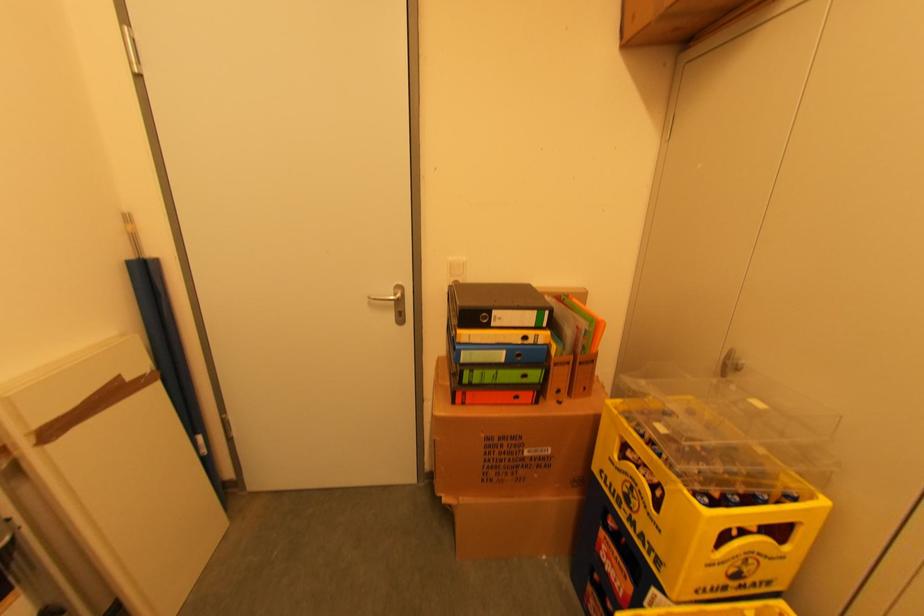
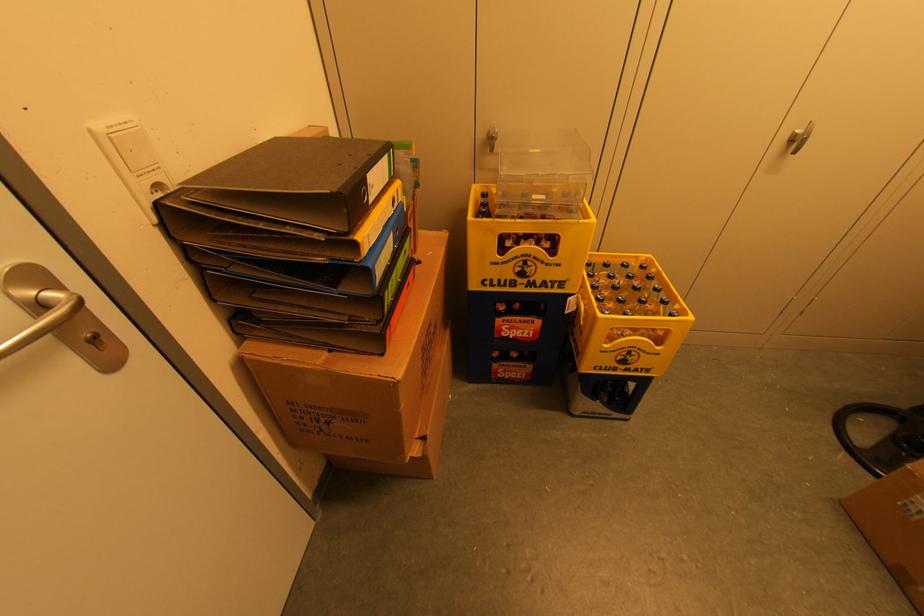
Where in the second image is the point corresponding to the point at 497,315 from the first image?

(371, 185)